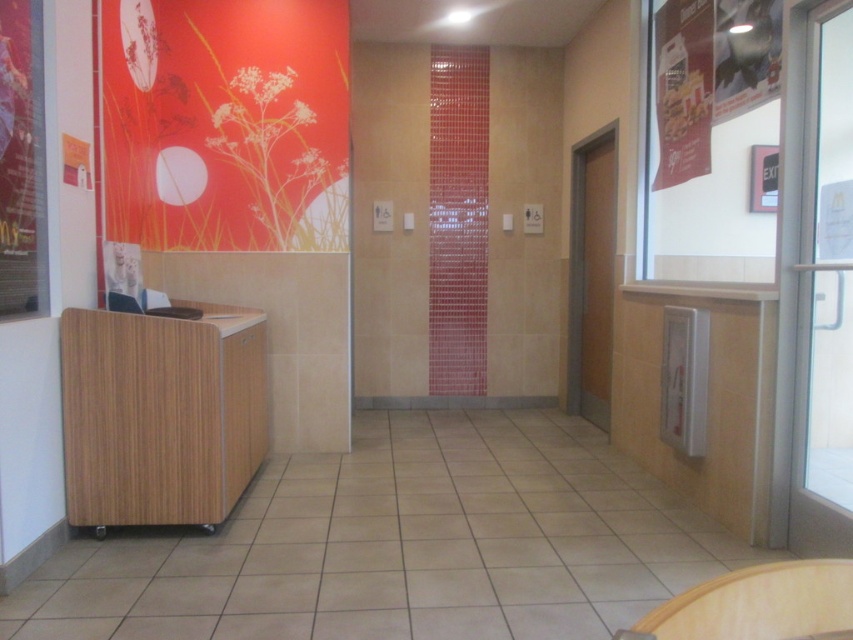
Is metallic gold poster at upper right positioned in front of matte paper poster at upper right?

No, it is not.

Is point (670, 72) farther from viewer compared to point (753, 28)?

Yes, it is behind point (753, 28).

Where is `metallic gold poster at upper right`? The width and height of the screenshot is (853, 640). metallic gold poster at upper right is located at coordinates (683, 90).

Can you confirm if matte red poster at upper left is taller than matte paper poster at left?

Yes.

Does matte red poster at upper left have a greater width compared to matte paper poster at left?

Correct, the width of matte red poster at upper left exceeds that of matte paper poster at left.

The width and height of the screenshot is (853, 640). I want to click on matte red poster at upper left, so click(225, 124).

Is matte paper poster at left wider than metallic gold poster at upper right?

No.

Does point (15, 257) lie behind point (674, 28)?

No, it is not.

Locate an element on the screen. matte paper poster at left is located at coordinates (22, 163).